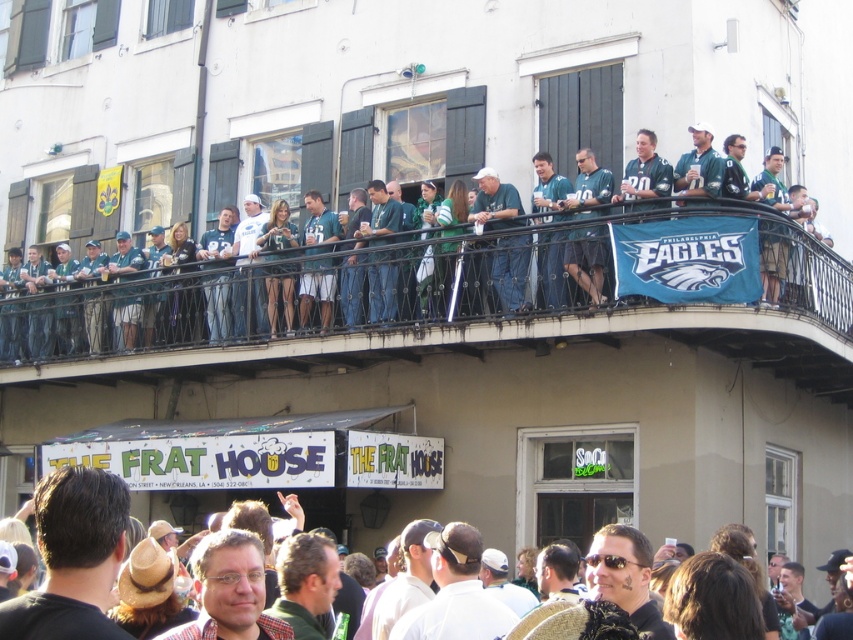
What do you see at coordinates (302, 289) in the screenshot? Image resolution: width=853 pixels, height=640 pixels. I see `matte green jersey at center` at bounding box center [302, 289].

This screenshot has width=853, height=640. I want to click on matte green jersey at center, so click(x=302, y=289).

Describe the element at coordinates (302, 289) in the screenshot. The width and height of the screenshot is (853, 640). I see `matte green jersey at center` at that location.

This screenshot has width=853, height=640. I want to click on matte green jersey at center, so click(x=302, y=289).